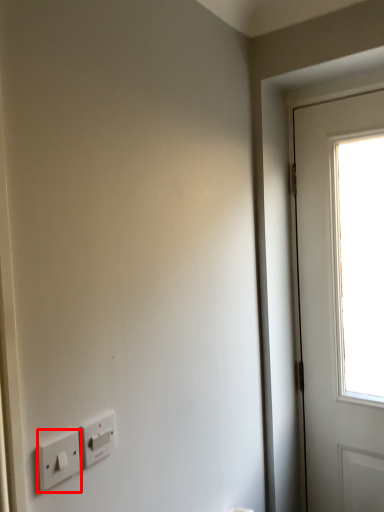
Question: In this image, where is light switch (annotated by the red box) located relative to light switch?

Choices:
 (A) right
 (B) left

Answer: (B)